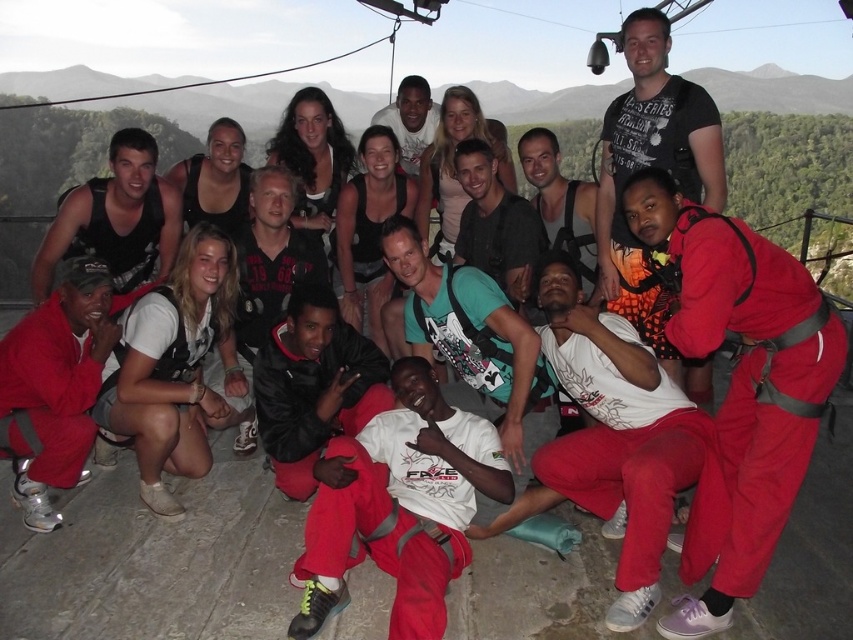
You are standing at the origin point of the image. You see two points marked in the scene. Which point is closer to you, the point at coordinates (196,384) or the point at (631,157)?

The point at coordinates (196,384) is closer to you because it is in front of the point at (631,157).